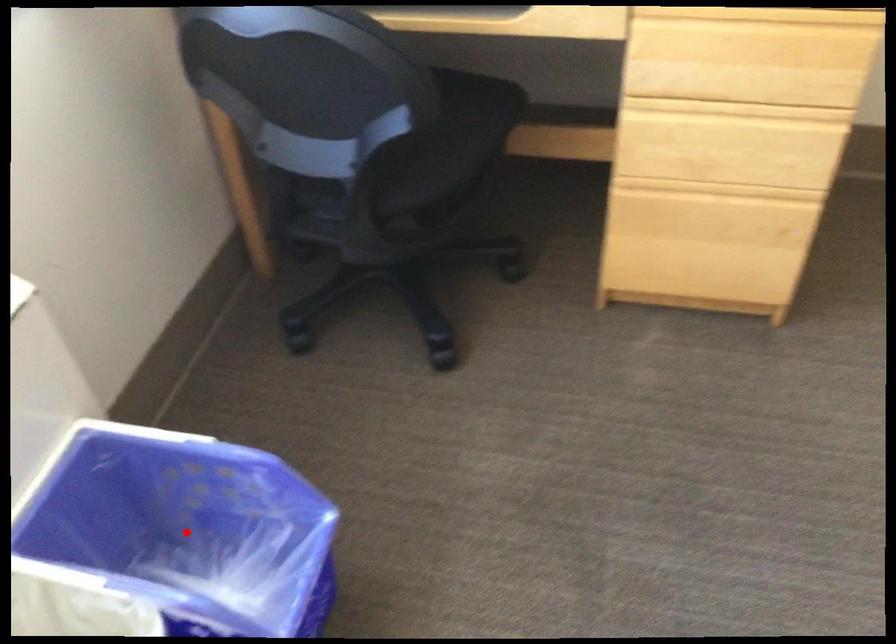
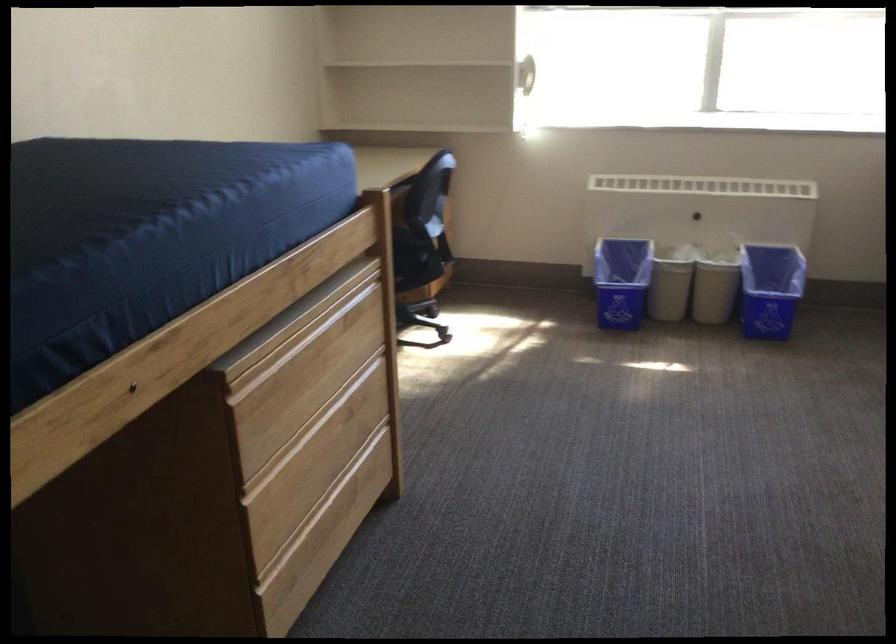
Question: I am providing you with two images of the same scene from different viewpoints. A red point is shown in image1. For the corresponding object point in image2, is it positioned nearer or farther from the camera?

Choices:
 (A) Nearer
 (B) Farther

Answer: (B)